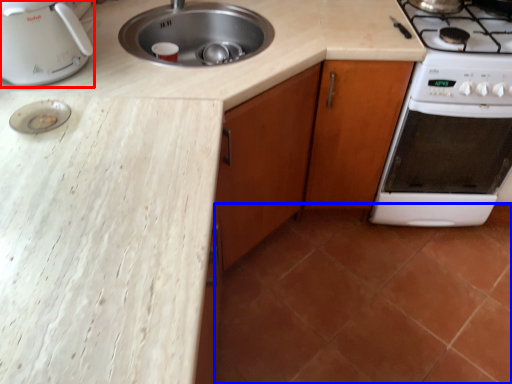
Question: Which point is further to the camera, kitchen appliance (highlighted by a red box) or tile (highlighted by a blue box)?

Choices:
 (A) kitchen appliance
 (B) tile

Answer: (B)